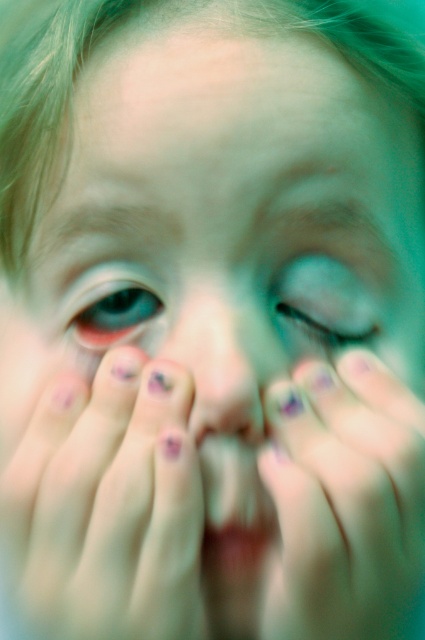
Between point (99, 285) and point (243, 548), which one is positioned behind?

Point (99, 285)

Is blue glossy eye at center smaller than smooth pink lips at center?

Actually, blue glossy eye at center might be larger than smooth pink lips at center.

I want to click on blue glossy eye at center, so click(113, 312).

Is matte purple nail polish at center above translucent blue eye at center?

No.

What do you see at coordinates (108, 506) in the screenshot? I see `matte purple nail polish at center` at bounding box center [108, 506].

Find the location of a particular element. matte purple nail polish at center is located at coordinates (108, 506).

Which of these two, pink matte/natural nose at center or smooth pink lips at center, stands taller?

Standing taller between the two is pink matte/natural nose at center.

Based on the photo, is pink matte/natural nose at center above smooth pink lips at center?

Correct, pink matte/natural nose at center is located above smooth pink lips at center.

Which is behind, point (197, 408) or point (215, 545)?

Positioned behind is point (215, 545).

At what (x,y) coordinates should I click in order to perform the action: click on pink matte/natural nose at center. Please return your answer as a coordinate pair (x, y). The height and width of the screenshot is (640, 425). Looking at the image, I should click on (215, 369).